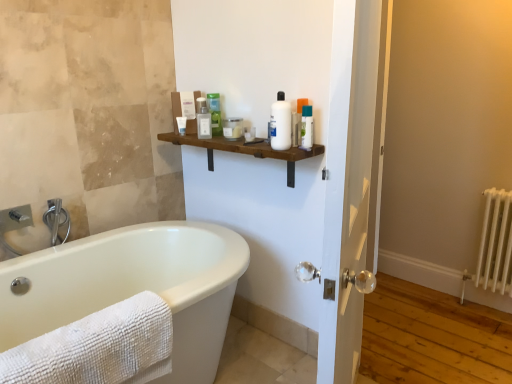
Locate an element on the screen. blank space situated above white textured towel at lower left (from a real-world perspective) is located at coordinates (85, 328).